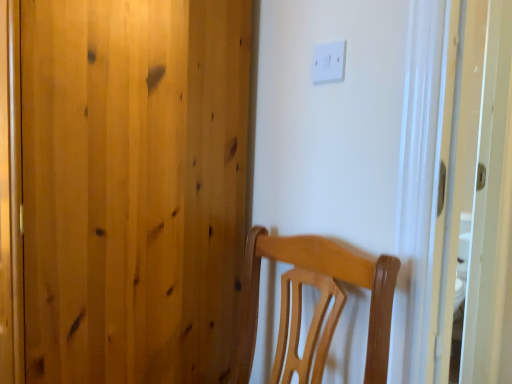
Question: Is natural wood door at center looking in the opposite direction of white plastic light switch at upper center?

Choices:
 (A) no
 (B) yes

Answer: (A)

Question: Does natural wood door at center have a lesser height compared to white plastic light switch at upper center?

Choices:
 (A) yes
 (B) no

Answer: (B)

Question: Could you tell me if natural wood door at center is facing white plastic light switch at upper center?

Choices:
 (A) no
 (B) yes

Answer: (A)

Question: From a real-world perspective, is natural wood door at center below white plastic light switch at upper center?

Choices:
 (A) yes
 (B) no

Answer: (A)

Question: Can you confirm if natural wood door at center is taller than white plastic light switch at upper center?

Choices:
 (A) yes
 (B) no

Answer: (A)

Question: Is natural wood door at center far from white plastic light switch at upper center?

Choices:
 (A) no
 (B) yes

Answer: (A)

Question: Is white plastic light switch at upper center looking in the opposite direction of natural wood door at center?

Choices:
 (A) yes
 (B) no

Answer: (B)

Question: Is white plastic light switch at upper center wider than natural wood door at center?

Choices:
 (A) yes
 (B) no

Answer: (B)

Question: Considering the relative sizes of white plastic light switch at upper center and natural wood door at center in the image provided, is white plastic light switch at upper center bigger than natural wood door at center?

Choices:
 (A) no
 (B) yes

Answer: (A)

Question: Is white plastic light switch at upper center to the right of natural wood door at center from the viewer's perspective?

Choices:
 (A) no
 (B) yes

Answer: (B)

Question: Does white plastic light switch at upper center turn towards natural wood door at center?

Choices:
 (A) no
 (B) yes

Answer: (A)

Question: Is the depth of white plastic light switch at upper center greater than that of natural wood door at center?

Choices:
 (A) yes
 (B) no

Answer: (A)

Question: From a real-world perspective, is natural wood door at center above or below white plastic light switch at upper center?

Choices:
 (A) below
 (B) above

Answer: (A)